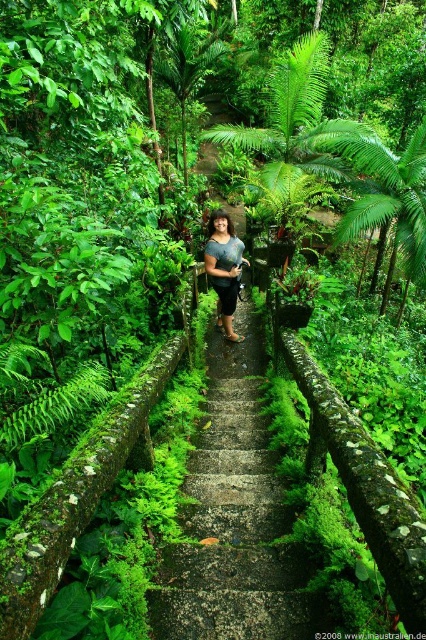
Question: Which point is closer to the camera taking this photo?

Choices:
 (A) (244, 356)
 (B) (226, 289)

Answer: (B)

Question: Which of the following is the closest to the observer?

Choices:
 (A) matte blue shirt at center
 (B) green mossy stone steps at center

Answer: (B)

Question: Which point is closer to the camera taking this photo?

Choices:
 (A) (313, 609)
 (B) (218, 280)

Answer: (A)

Question: Does green mossy stone steps at center have a smaller size compared to matte blue shirt at center?

Choices:
 (A) no
 (B) yes

Answer: (B)

Question: Is green mossy stone steps at center to the right of matte blue shirt at center from the viewer's perspective?

Choices:
 (A) no
 (B) yes

Answer: (B)

Question: Can you confirm if green mossy stone steps at center is positioned to the left of matte blue shirt at center?

Choices:
 (A) no
 (B) yes

Answer: (A)